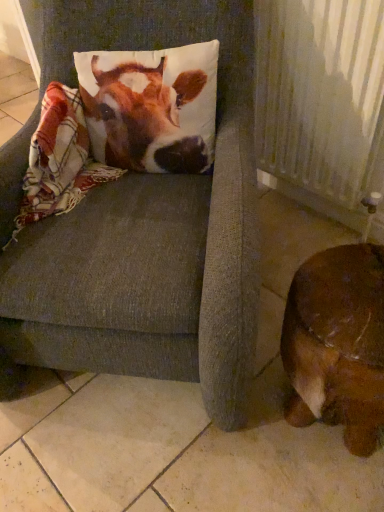
Question: From the image's perspective, is brown leather dog at lower right below printed fabric pillow at upper left?

Choices:
 (A) no
 (B) yes

Answer: (B)

Question: Is the depth of brown leather dog at lower right greater than that of printed fabric pillow at upper left?

Choices:
 (A) yes
 (B) no

Answer: (B)

Question: Is brown leather dog at lower right far from printed fabric pillow at upper left?

Choices:
 (A) yes
 (B) no

Answer: (B)

Question: Is brown leather dog at lower right touching printed fabric pillow at upper left?

Choices:
 (A) no
 (B) yes

Answer: (A)

Question: From the image's perspective, does brown leather dog at lower right appear higher than printed fabric pillow at upper left?

Choices:
 (A) yes
 (B) no

Answer: (B)

Question: Is brown leather dog at lower right facing away from printed fabric pillow at upper left?

Choices:
 (A) yes
 (B) no

Answer: (B)

Question: Is printed fabric pillow at upper left turned away from textured gray cushion at center?

Choices:
 (A) yes
 (B) no

Answer: (A)

Question: Does printed fabric pillow at upper left turn towards textured gray cushion at center?

Choices:
 (A) no
 (B) yes

Answer: (B)

Question: Considering the relative positions of printed fabric pillow at upper left and textured gray cushion at center in the image provided, is printed fabric pillow at upper left behind textured gray cushion at center?

Choices:
 (A) yes
 (B) no

Answer: (A)

Question: Does printed fabric pillow at upper left lie in front of textured gray cushion at center?

Choices:
 (A) no
 (B) yes

Answer: (A)

Question: Is printed fabric pillow at upper left at the left side of textured gray cushion at center?

Choices:
 (A) no
 (B) yes

Answer: (A)

Question: Does printed fabric pillow at upper left have a lesser width compared to textured gray cushion at center?

Choices:
 (A) yes
 (B) no

Answer: (A)

Question: Can you confirm if printed fabric pillow at upper left is thinner than brown leather dog at lower right?

Choices:
 (A) yes
 (B) no

Answer: (A)